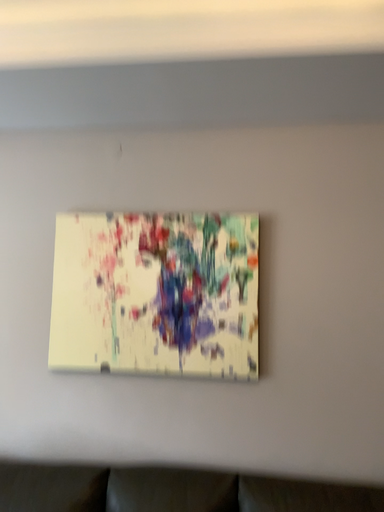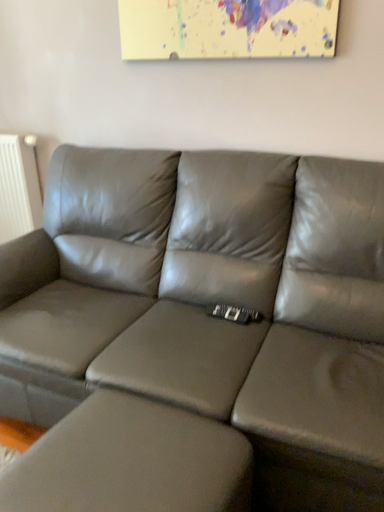
Question: How did the camera likely rotate when shooting the video?

Choices:
 (A) rotated right
 (B) rotated left

Answer: (B)